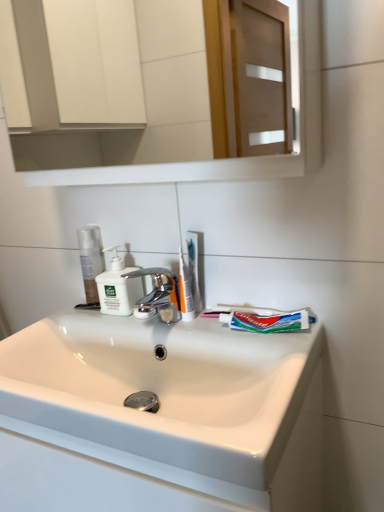
I want to click on vacant area situated to the left side of chrome metallic faucet at center, so click(x=92, y=321).